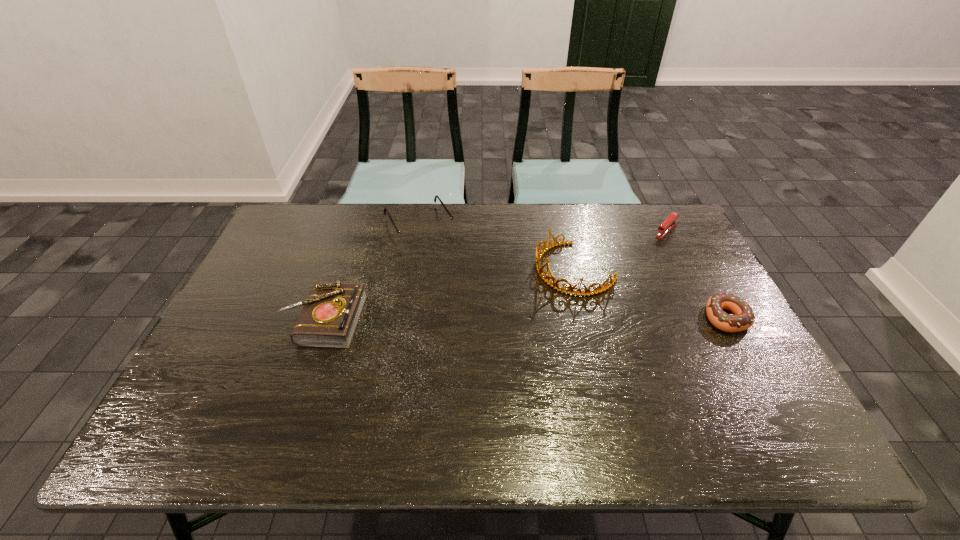
What are the coordinates of `empty location between the stapler and the diary` in the screenshot? It's located at (495, 275).

In order to click on unoccupied area between the spectacles and the diary in this screenshot , I will do `click(372, 272)`.

I want to click on empty space that is in between the stapler and the diary, so click(495, 275).

This screenshot has width=960, height=540. Find the location of `free space between the spectacles and the third object from right to left`. free space between the spectacles and the third object from right to left is located at coordinates (x=497, y=247).

The height and width of the screenshot is (540, 960). Find the location of `empty space that is in between the spectacles and the diary`. empty space that is in between the spectacles and the diary is located at coordinates (372, 272).

This screenshot has height=540, width=960. What are the coordinates of `unoccupied position between the doughnut and the spectacles` in the screenshot? It's located at (572, 271).

You are a GUI agent. You are given a task and a screenshot of the screen. Output one action in this format:
    pyautogui.click(x=<x>, y=<y>)
    Task: Click on the vacant point located between the stapler and the spectacles
    
    Given the screenshot: What is the action you would take?
    pyautogui.click(x=542, y=227)

I want to click on vacant space in between the spectacles and the doughnut, so click(x=572, y=271).

Find the location of a particular element. free space between the doughnut and the stapler is located at coordinates (696, 274).

Locate which object ranks fourth in proximity to the stapler. Please provide its 2D coordinates. Your answer should be formatted as a tuple, i.e. [(x, y)], where the tuple contains the x and y coordinates of a point satisfying the conditions above.

[(329, 318)]